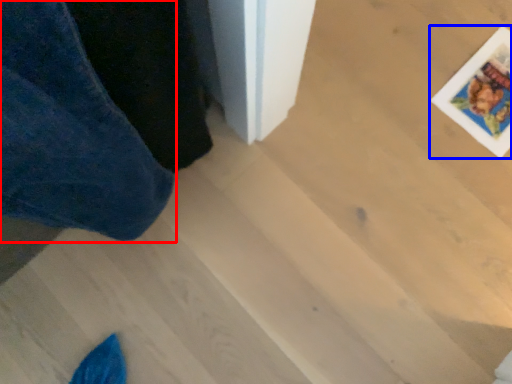
Question: Which point is closer to the camera, trousers (highlighted by a red box) or postcard (highlighted by a blue box)?

Choices:
 (A) trousers
 (B) postcard

Answer: (A)